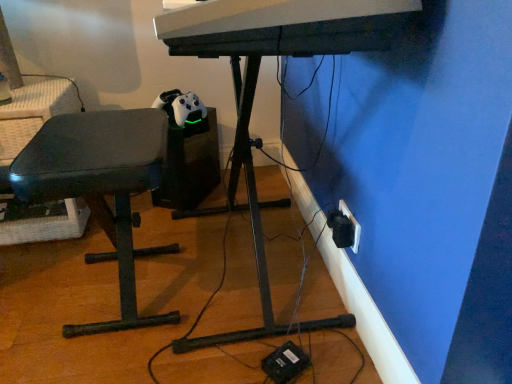
Locate an element on the screen. The image size is (512, 384). vacant space underneath white plastic computer desk at center (from a real-world perspective) is located at coordinates (247, 278).